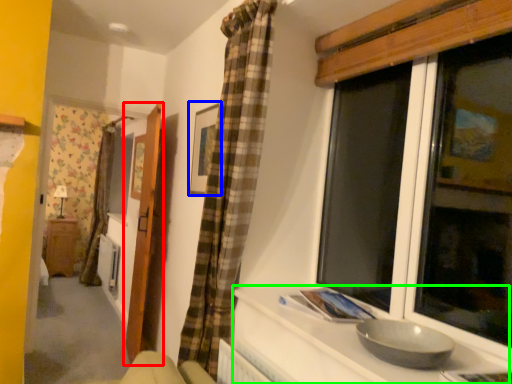
Question: Which object is the closest to the door (highlighted by a red box)? Choose among these: picture frame (highlighted by a blue box) or counter top (highlighted by a green box).

Choices:
 (A) picture frame
 (B) counter top

Answer: (A)